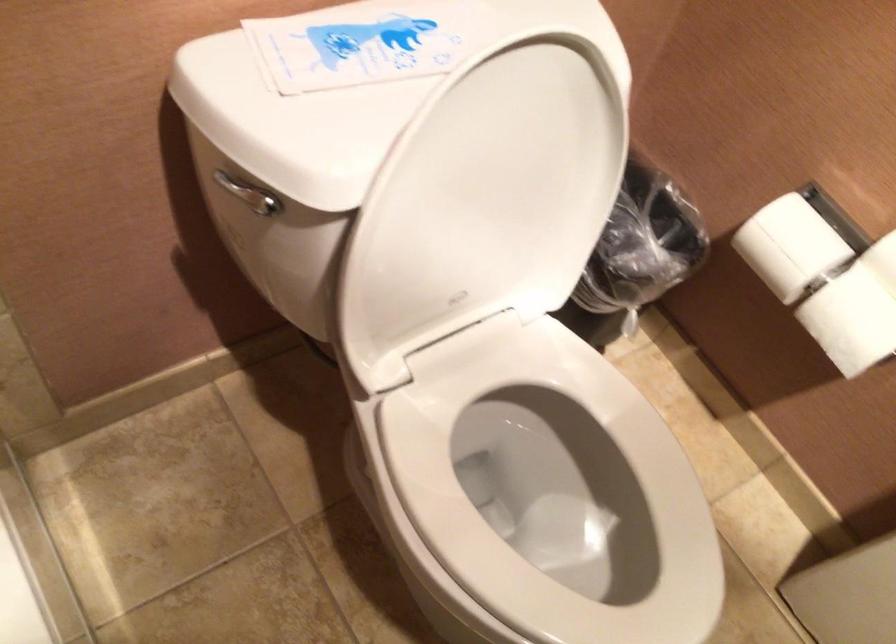
You are a GUI agent. You are given a task and a screenshot of the screen. Output one action in this format:
    pyautogui.click(x=<x>, y=<y>)
    Task: Click on the white toilet seat
    
    Given the screenshot: What is the action you would take?
    pyautogui.click(x=554, y=489)